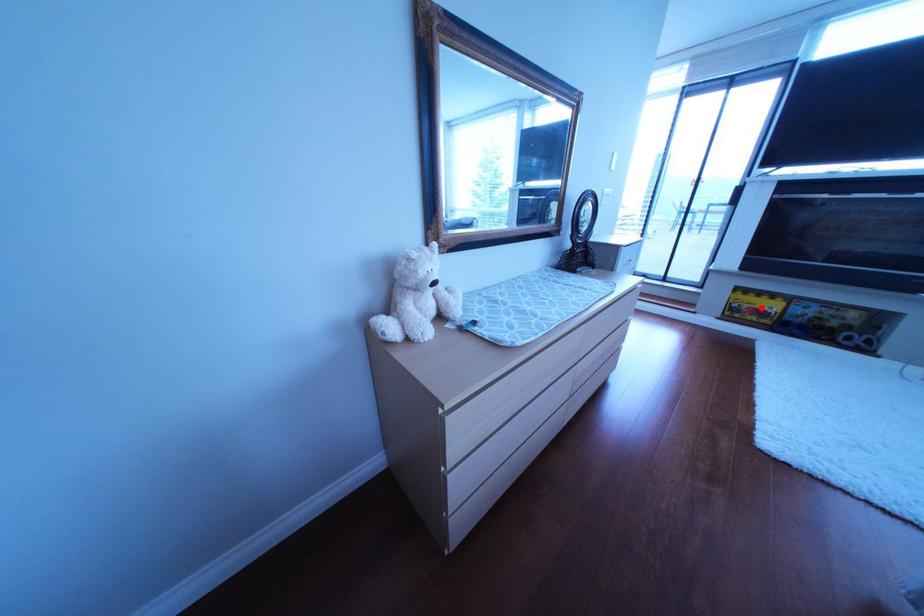
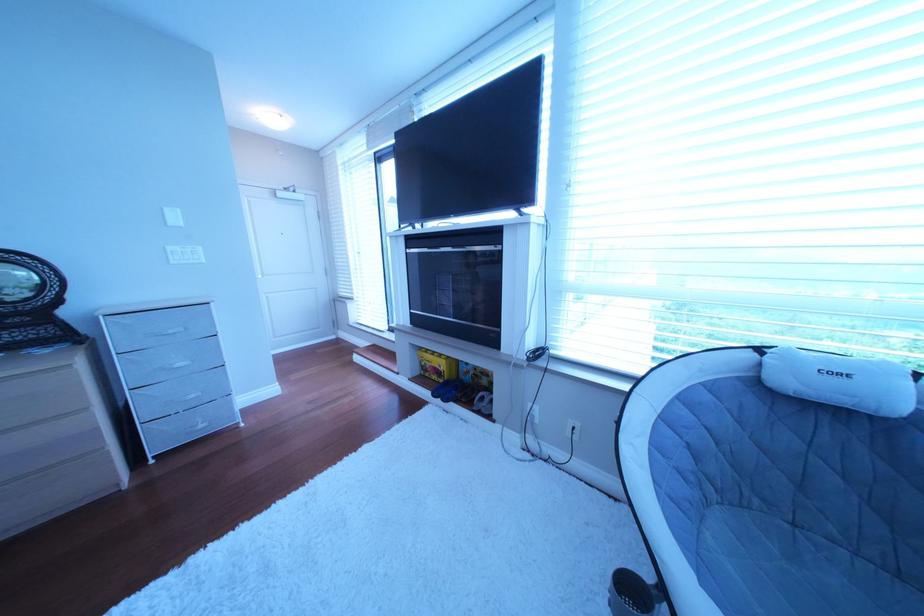
Find the pixel in the second image that matches the highlighted location in the first image.

(444, 367)